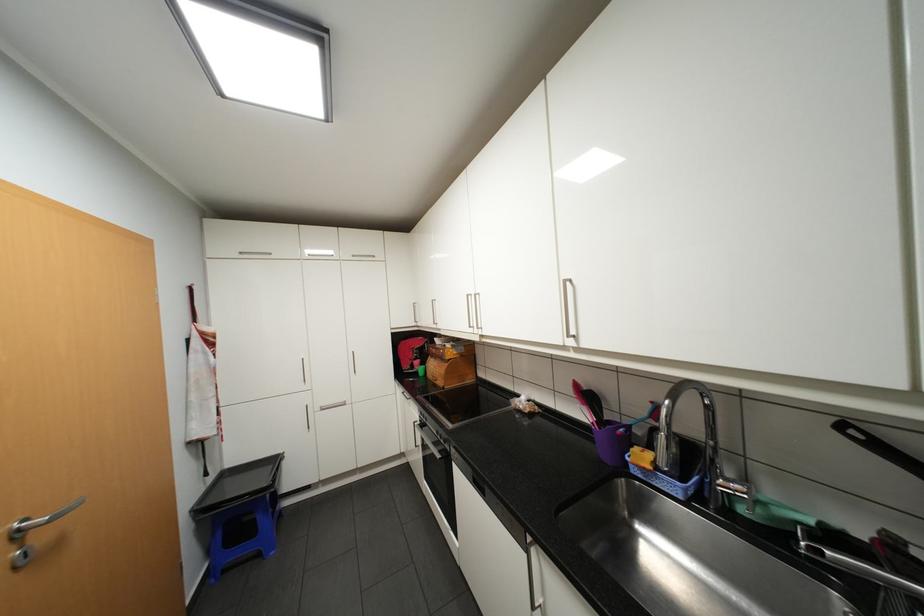
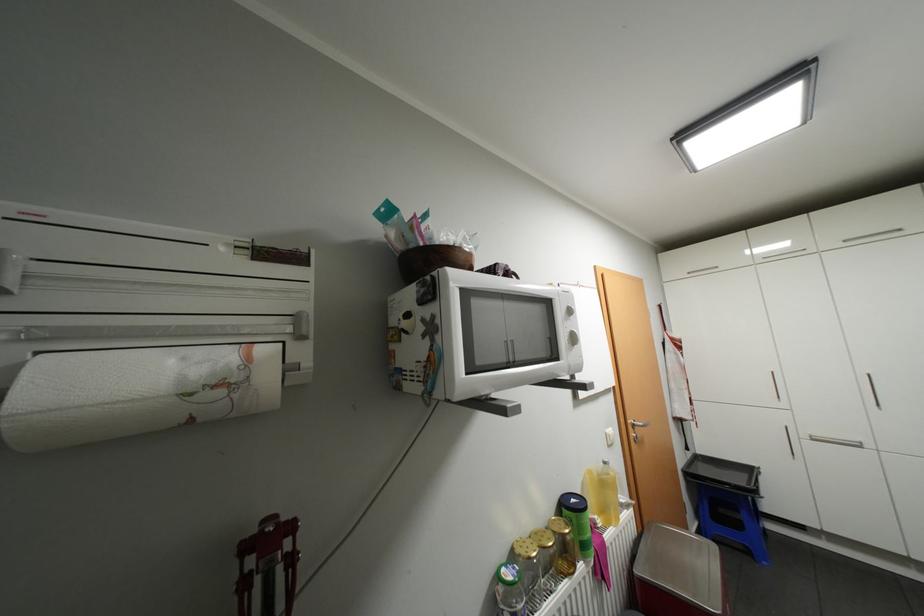
Locate, in the second image, the point that corresponds to (220,476) in the first image.

(697, 453)